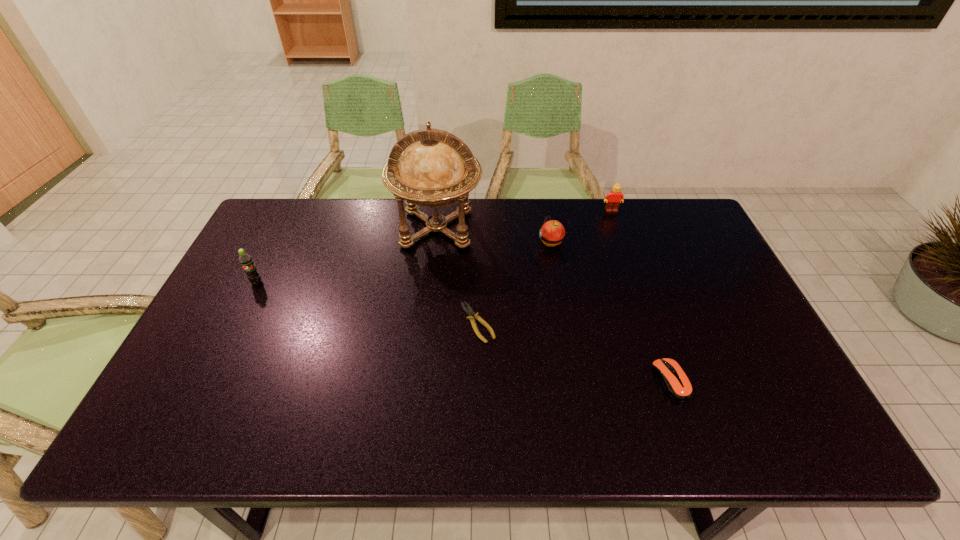
The image size is (960, 540). Identify the location of free location that satisfies the following two spatial constraints: 1. on the front-facing side of the third shortest object; 2. on the right side of the globe. (436, 242).